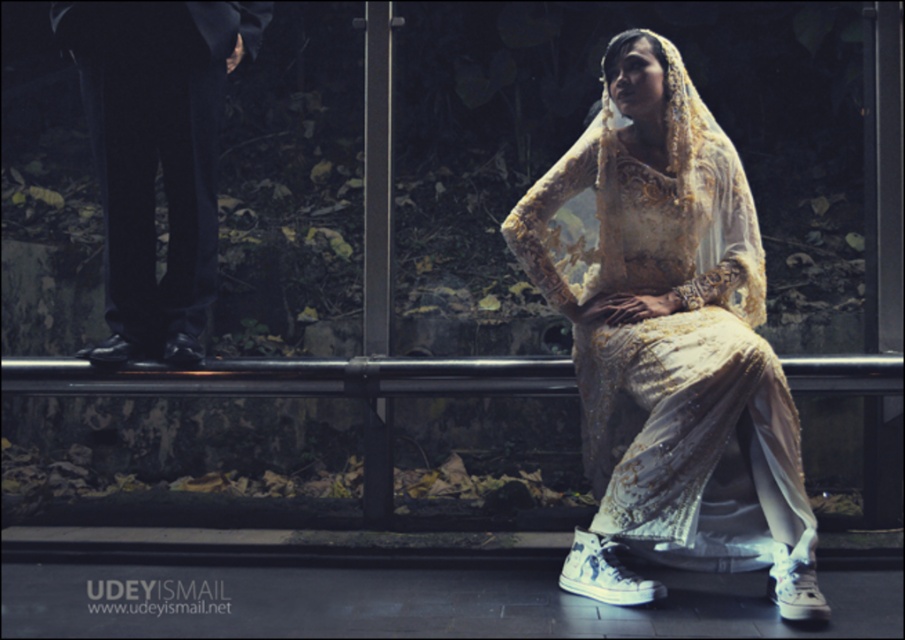
You are a photographer setting up for a photoshoot. You need to position a spotlight so that it illuminates both the matte gold lace dress at center and the black satin pants at left without casting shadows over the glass window. Considering their positions, which object should be closer to the window to avoid shadows?

The matte gold lace dress at center is in front of the black satin pants at left. To avoid casting shadows on the glass window, the black satin pants at left should be placed closer to the window since the matte gold lace dress at center is already in front, so moving the pants back would cause their shadow to fall behind the dress, but since the dress is in front, moving the dress closer to the window would cast its shadow over the pants. Wait, perhaps I need to think differently. If the dress is in front,

You are a photographer positioned at the camera. You want to capture a closeup shot of the matte gold lace dress at center. Given that you are 9.76 feet away from it, can you move closer to get a better closeup without exceeding the minimum focusing distance of your lens, which is 5 feet?

The distance between the matte gold lace dress at center and the camera is 9.76 feet. Since the minimum focusing distance of the lens is 5 feet, you can move closer to within 5 feet to achieve a better closeup while still maintaining focus.

You are a photographer setting up a shoot in the described scene. You need to position a spotlight so that it illuminates both the matte gold lace dress at center and the black satin pants at left without creating harsh shadows. Considering their heights, which object should be placed closer to the spotlight to achieve even lighting?

The matte gold lace dress at center is taller than the black satin pants at left, so placing the spotlight closer to the black satin pants at left will help achieve even lighting between both objects.